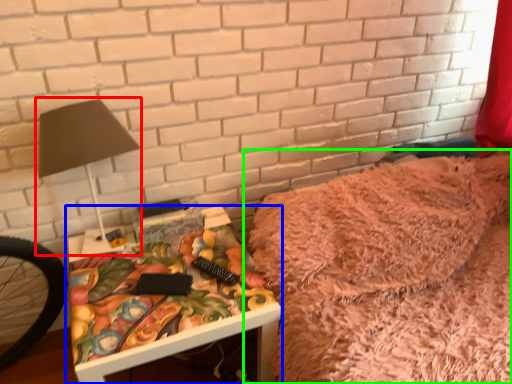
Question: Which is nearer to the table lamp (highlighted by a red box)? table (highlighted by a blue box) or furniture (highlighted by a green box).

Choices:
 (A) table
 (B) furniture

Answer: (A)